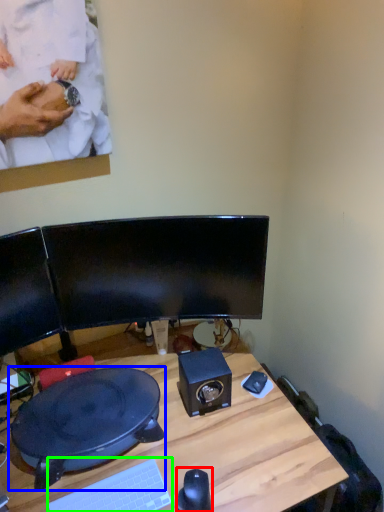
Question: Estimate the real-world distances between objects in this image. Which object is farther from mouse (highlighted by a red box), sit (highlighted by a blue box) or computer keyboard (highlighted by a green box)?

Choices:
 (A) sit
 (B) computer keyboard

Answer: (A)